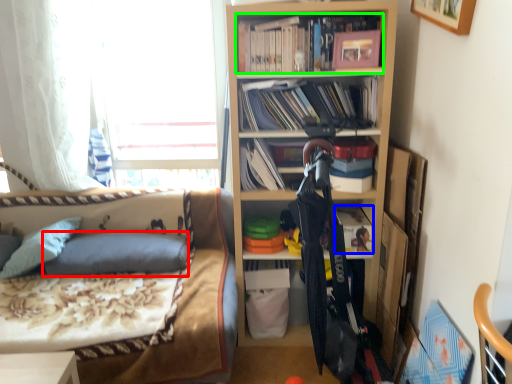
Question: Considering the real-world distances, which object is farthest from pillow (highlighted by a red box)? book (highlighted by a blue box) or book (highlighted by a green box)?

Choices:
 (A) book
 (B) book

Answer: (B)